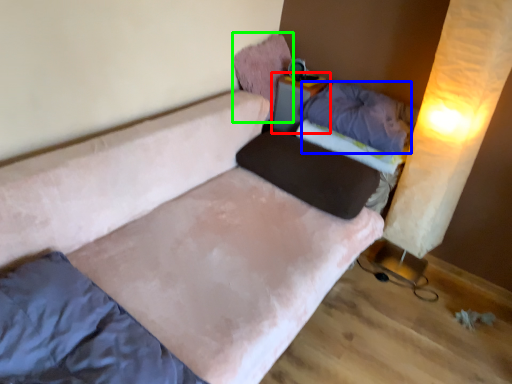
Question: Estimate the real-world distances between objects in this image. Which object is closer to table (highlighted by a red box), pillow (highlighted by a blue box) or pillow (highlighted by a green box)?

Choices:
 (A) pillow
 (B) pillow

Answer: (B)